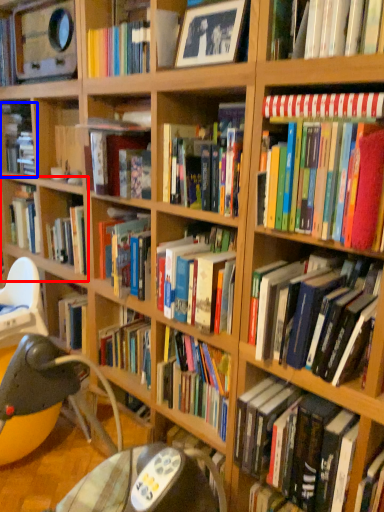
Question: Which object appears farthest to the camera in this image, shelf (highlighted by a red box) or book (highlighted by a blue box)?

Choices:
 (A) shelf
 (B) book

Answer: (B)